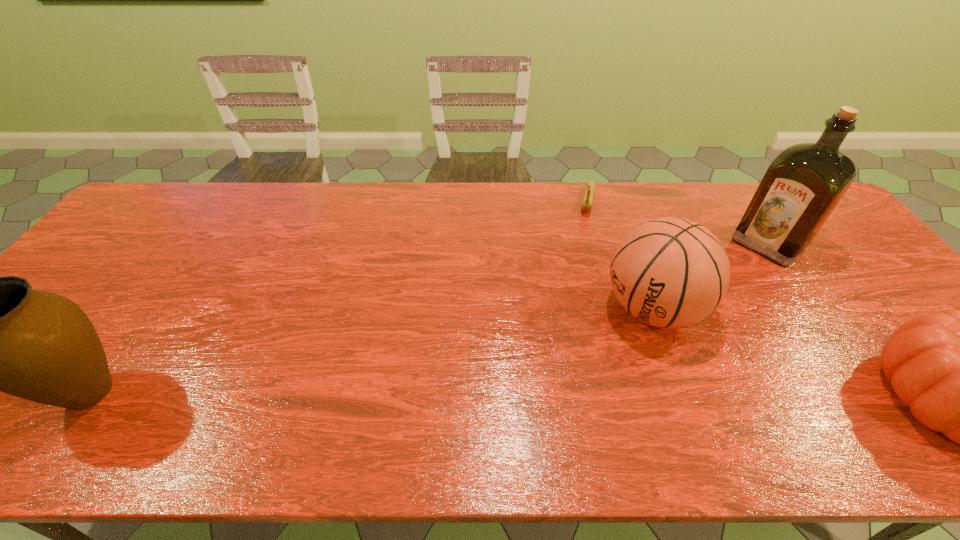
This screenshot has width=960, height=540. Identify the location of vacant position located 0.190m at the stem of the farthest object. (581, 255).

Locate an element on the screen. vacant space located 0.380m at the stem of the farthest object is located at coordinates (570, 303).

Find the location of `free space located at the stem of the farthest object`. free space located at the stem of the farthest object is located at coordinates (579, 265).

Identify the location of vacant region located on the label of the tallest object. (719, 290).

At what (x,y) coordinates should I click in order to perform the action: click on free region located 0.300m on the label of the tallest object. Please return your answer as a coordinate pair (x, y). The image size is (960, 540). Looking at the image, I should click on (695, 312).

The width and height of the screenshot is (960, 540). Find the location of `vacant space located on the label of the tallest object`. vacant space located on the label of the tallest object is located at coordinates (723, 286).

Locate an element on the screen. This screenshot has width=960, height=540. banana present at the far edge is located at coordinates (587, 202).

This screenshot has width=960, height=540. In order to click on liquor situated at the far edge in this screenshot , I will do `click(802, 186)`.

Locate an element on the screen. The width and height of the screenshot is (960, 540). object that is at the near edge is located at coordinates (0, 334).

This screenshot has width=960, height=540. Identify the location of object at the left edge. (0, 334).